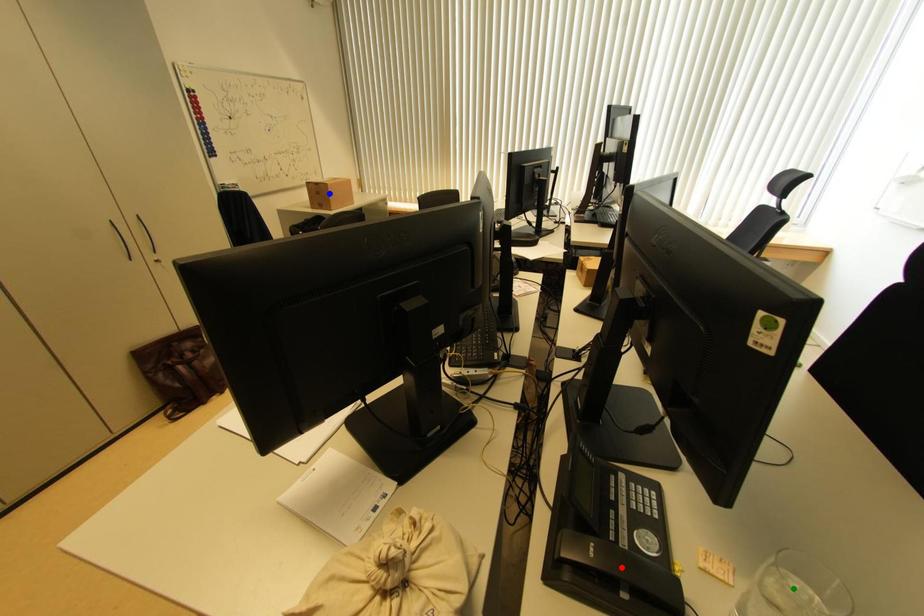
Order these from nearest to farthest:
blue point
red point
green point

green point < red point < blue point